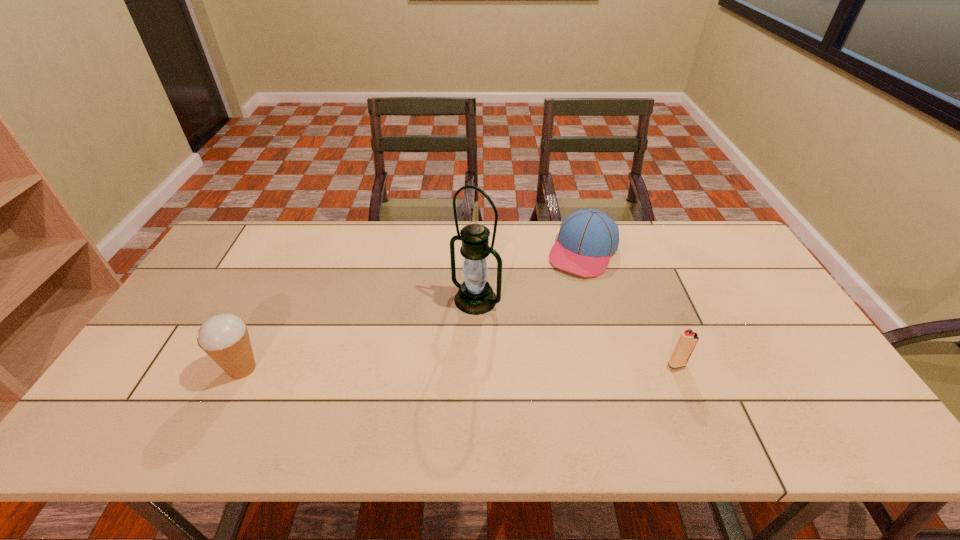
Locate an element on the screen. The image size is (960, 540). the second tallest object is located at coordinates (224, 337).

Identify the location of icecream. (224, 337).

The image size is (960, 540). I want to click on igniter, so click(x=688, y=339).

Image resolution: width=960 pixels, height=540 pixels. I want to click on the farthest object, so click(587, 238).

The width and height of the screenshot is (960, 540). In order to click on baseball cap in this screenshot , I will do `click(587, 238)`.

Image resolution: width=960 pixels, height=540 pixels. Find the location of `the third nearest object`. the third nearest object is located at coordinates (475, 296).

You are a GUI agent. You are given a task and a screenshot of the screen. Output one action in this format:
    pyautogui.click(x=<x>, y=<y>)
    Task: Click on the lantern
    
    Given the screenshot: What is the action you would take?
    pyautogui.click(x=475, y=296)

Locate an element on the screen. blank space located on the back of the leftmost object is located at coordinates pyautogui.click(x=286, y=278).

Image resolution: width=960 pixels, height=540 pixels. What are the coordinates of `free space located on the left of the igniter` in the screenshot? It's located at (609, 364).

You are a GUI agent. You are given a task and a screenshot of the screen. Output one action in this format:
    pyautogui.click(x=<x>, y=<y>)
    Task: Click on the free location located 0.120m on the front-facing side of the second object from right to left
    
    Given the screenshot: What is the action you would take?
    pyautogui.click(x=559, y=300)